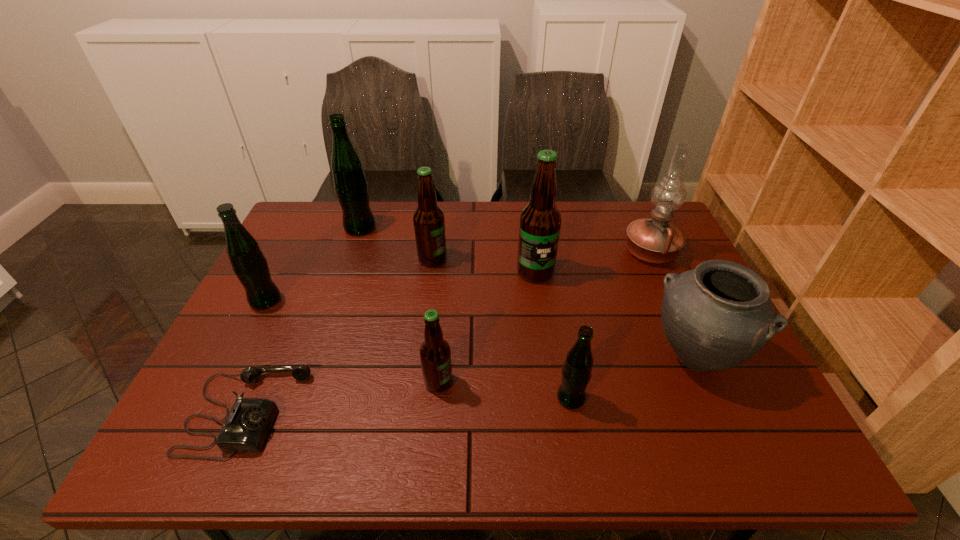
At what (x,y) coordinates should I click in order to perform the action: click on the biggest green beer bottle. Please return your answer as a coordinate pair (x, y). The image size is (960, 540). Looking at the image, I should click on (350, 183).

Locate an element on the screen. This screenshot has height=540, width=960. the farthest beer bottle is located at coordinates (350, 183).

At what (x,y) coordinates should I click in order to perform the action: click on the rightmost brown beer bottle. Please return your answer as a coordinate pair (x, y). Looking at the image, I should click on (540, 222).

Where is `oil lamp`? oil lamp is located at coordinates (655, 240).

The width and height of the screenshot is (960, 540). I want to click on the second smallest brown beer bottle, so click(429, 225).

Locate an element on the screen. the fifth nearest object is located at coordinates (248, 262).

Where is `the leftmost beer bottle`? The height and width of the screenshot is (540, 960). the leftmost beer bottle is located at coordinates (248, 262).

Where is `black urn`? This screenshot has height=540, width=960. black urn is located at coordinates (715, 317).

You are a GUI agent. You are given a task and a screenshot of the screen. Output one action in this format:
    pyautogui.click(x=<x>, y=<y>)
    Task: Click on the smallest brown beer bottle
    
    Given the screenshot: What is the action you would take?
    pyautogui.click(x=435, y=354)

The image size is (960, 540). I want to click on the smallest green beer bottle, so click(577, 370).